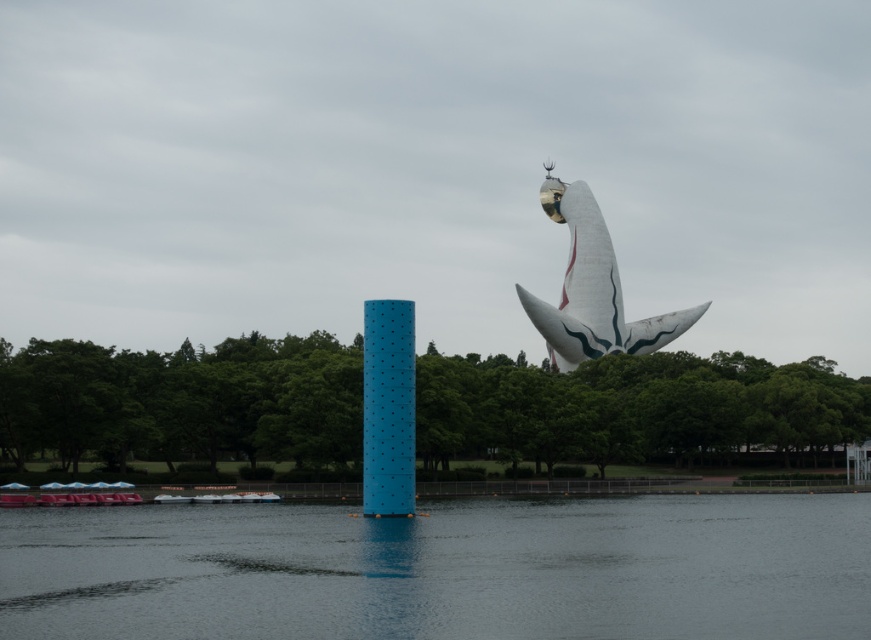
You are a photographer standing at the lakeside. You want to capture a photo where the smooth gray water at lower center and the white plastic boat at lower left are both visible. Considering their heights, which object will appear larger in the photo?

The smooth gray water at lower center will appear larger in the photo because it has a greater height compared to the white plastic boat at lower left.

You are standing at the lakeside and want to take a photo of the white plastic boat at lower left without the smooth gray water at lower center blocking the view. Is this possible given their positions?

The smooth gray water at lower center is in front of the white plastic boat at lower left, so it would block the view. To take a photo of the white plastic boat at lower left without obstruction, you would need to adjust your position to avoid the smooth gray water at lower center being between you and the boat.

From the picture: You are standing at the lakeside and want to reach a specific point marked at coordinates point (805, 616). If your maximum walking distance is 80 feet, will you be able to reach it without swimming?

The distance of point (805, 616) from viewer is 85.70 feet, which exceeds your maximum walking distance of 80 feet. Therefore, you cannot reach it without swimming.